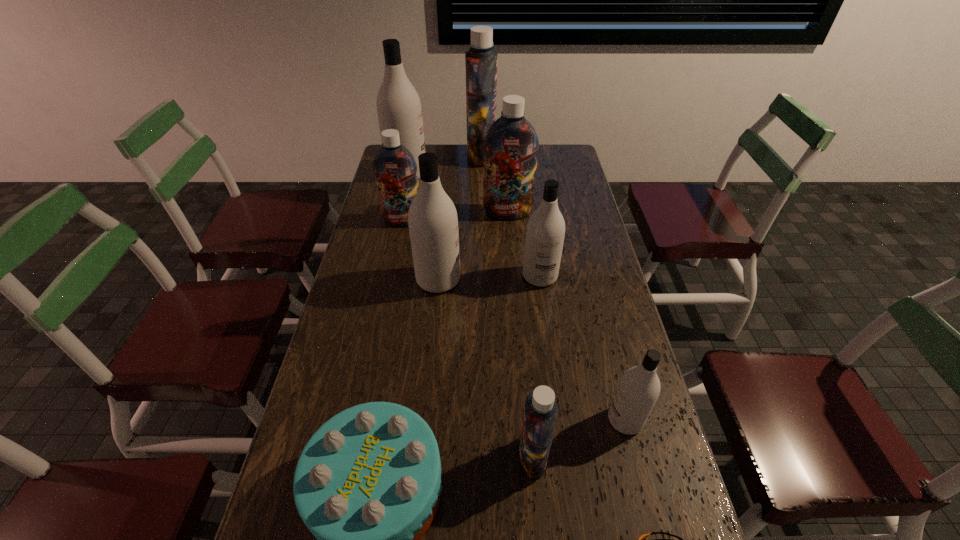
Where is `the fourth closest blue shampoo to the second smallest white shampoo`? Image resolution: width=960 pixels, height=540 pixels. the fourth closest blue shampoo to the second smallest white shampoo is located at coordinates (481, 60).

Identify which blue shampoo is located as the second nearest to the second smallest blue shampoo. Please provide its 2D coordinates. Your answer should be formatted as a tuple, i.e. [(x, y)], where the tuple contains the x and y coordinates of a point satisfying the conditions above.

[(481, 60)]

Identify the location of white shampoo that is the closest one to the second biggest white shampoo. This screenshot has height=540, width=960. (545, 233).

At what (x,y) coordinates should I click in order to perform the action: click on the second closest white shampoo to the third biggest blue shampoo. Please return your answer as a coordinate pair (x, y). This screenshot has height=540, width=960. Looking at the image, I should click on (398, 105).

What are the coordinates of `free space that satisfies the following two spatial constraints: 1. on the front-facing side of the second smallest white shampoo; 2. on the front-facing side of the sixth shampoo from right to left` in the screenshot? It's located at (540, 280).

The width and height of the screenshot is (960, 540). In order to click on free location that satisfies the following two spatial constraints: 1. on the front-facing side of the third biggest white shampoo; 2. on the front-facing side of the third white shampoo from right to left in this screenshot , I will do `click(540, 280)`.